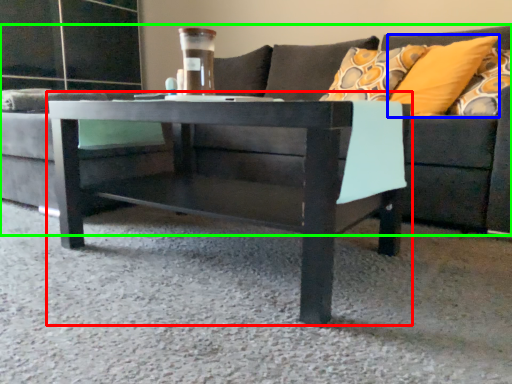
Question: Which object is the closest to the coffee table (highlighted by a red box)? Choose among these: pillow (highlighted by a blue box) or studio couch (highlighted by a green box).

Choices:
 (A) pillow
 (B) studio couch

Answer: (A)